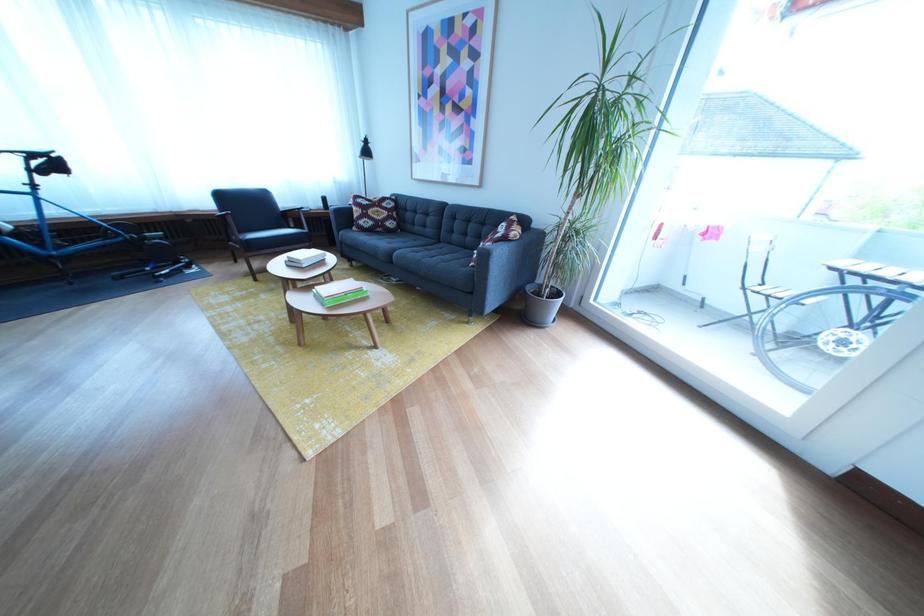
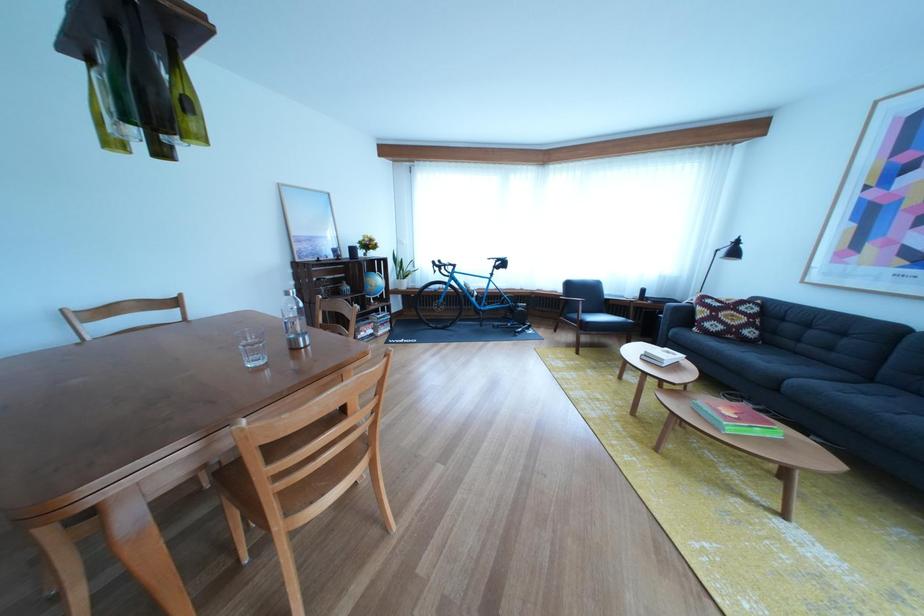
Find the pixel in the second image that matches (403,238) in the first image.

(758, 347)